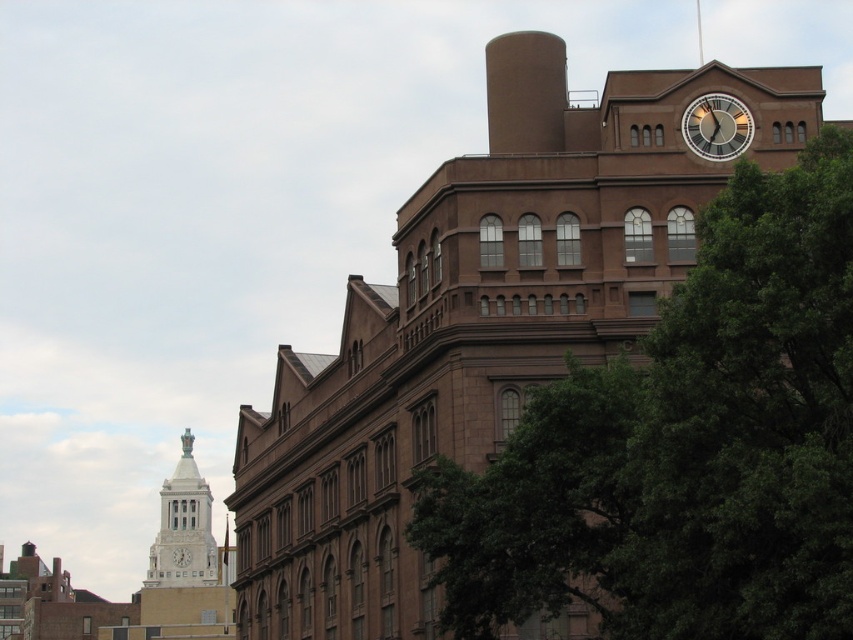
You are standing in front of the building and notice the white stone clock tower at left and the white glossy clock at upper right. Which clock is positioned higher up on the building?

The white glossy clock at upper right is positioned higher up on the building than the white stone clock tower at left.

You are an architect assessing the building for renovations. You need to determine if the brown matte chimney at upper center and the white stone clock tower at left can both be seen from the main entrance without obstruction. Based on their sizes, which one is more likely to be visible first as you approach the building?

The brown matte chimney at upper center has a larger size compared to the white stone clock tower at left. Since it is larger, it will likely be more visible first as you approach the building.

In the scene shown: You are an architect inspecting the building from the front. You notice two clocks on the facade. Which one, the white glossy clock at upper right or the white marble clock at upper center, is positioned closer to you?

The white glossy clock at upper right is closer to the viewer than the white marble clock at upper center.